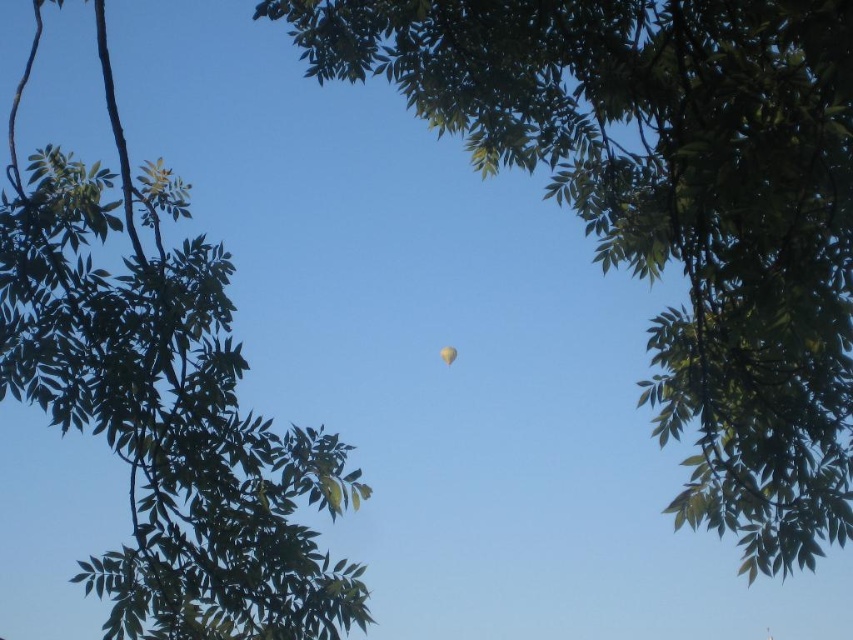
Question: Does green leafy tree at center appear on the left side of green leafy tree at upper center?

Choices:
 (A) no
 (B) yes

Answer: (A)

Question: Does green leafy tree at center appear under translucent yellow balloon at center?

Choices:
 (A) no
 (B) yes

Answer: (A)

Question: Can you confirm if green leafy tree at center is positioned to the right of green leafy tree at upper center?

Choices:
 (A) yes
 (B) no

Answer: (A)

Question: Which point is closer to the camera?

Choices:
 (A) translucent yellow balloon at center
 (B) green leafy tree at center

Answer: (B)

Question: Which point is farther from the camera taking this photo?

Choices:
 (A) (201, 593)
 (B) (445, 352)
 (C) (581, 76)

Answer: (B)

Question: Among these points, which one is nearest to the camera?

Choices:
 (A) (453, 353)
 (B) (697, 166)

Answer: (B)